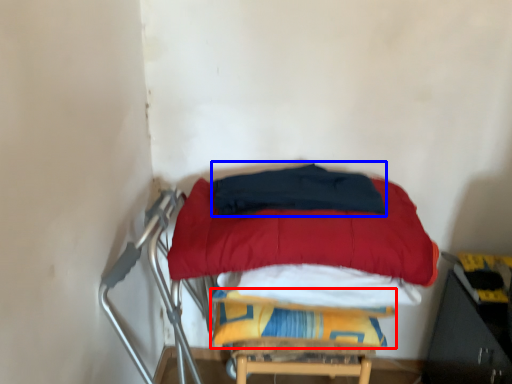
Question: Which object is closer to the camera taking this photo, blanket (highlighted by a red box) or blanket (highlighted by a blue box)?

Choices:
 (A) blanket
 (B) blanket

Answer: (B)